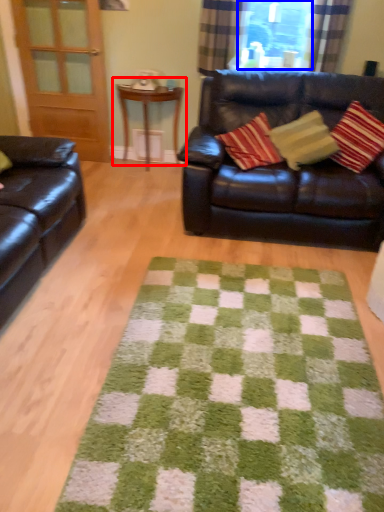
Question: Which object appears closest to the camera in this image, table (highlighted by a red box) or window screen (highlighted by a blue box)?

Choices:
 (A) table
 (B) window screen

Answer: (B)